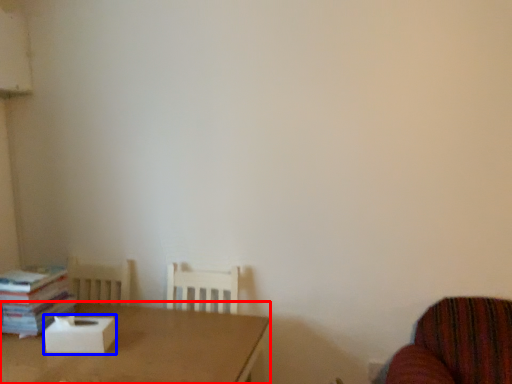
Question: Which point is further to the camera, table (highlighted by a red box) or cardboard box (highlighted by a blue box)?

Choices:
 (A) table
 (B) cardboard box

Answer: (B)